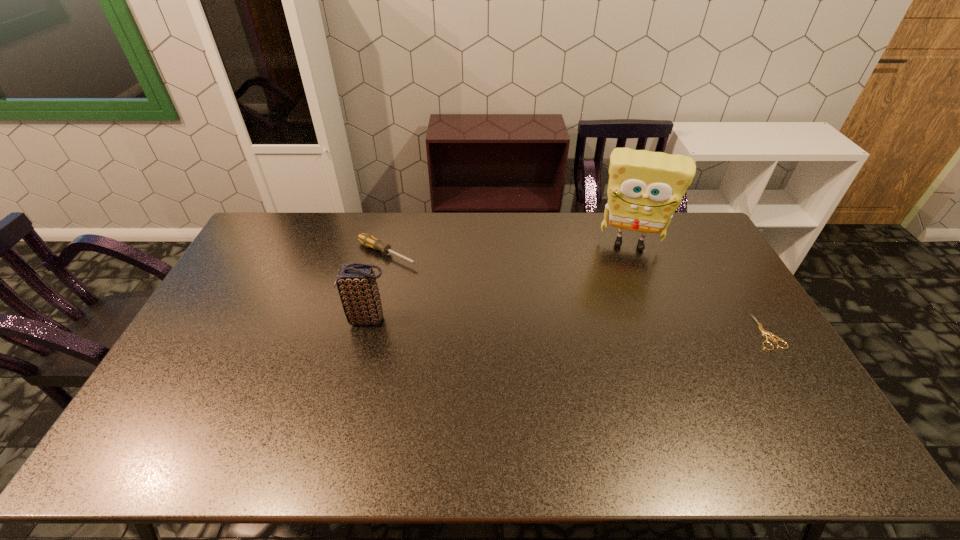
The width and height of the screenshot is (960, 540). In order to click on vacant area between the shortest object and the third shortest object in this screenshot , I will do point(567,326).

I want to click on vacant area that lies between the rightmost object and the screwdriver, so click(x=577, y=293).

This screenshot has height=540, width=960. I want to click on blank region between the second shortest object and the second object from right to left, so click(508, 248).

At what (x,y) coordinates should I click in order to perform the action: click on free point between the second shortest object and the second tallest object. Please return your answer as a coordinate pair (x, y). The width and height of the screenshot is (960, 540). Looking at the image, I should click on (378, 287).

Where is `object identified as the third closest to the clutch bag`? This screenshot has height=540, width=960. object identified as the third closest to the clutch bag is located at coordinates (764, 332).

Choose which object is the third nearest neighbor to the screwdriver. Please provide its 2D coordinates. Your answer should be formatted as a tuple, i.e. [(x, y)], where the tuple contains the x and y coordinates of a point satisfying the conditions above.

[(764, 332)]

Identify the location of vacant position in the image that satisfies the following two spatial constraints: 1. on the front side of the shortest object; 2. on the left side of the third tallest object. (369, 332).

This screenshot has width=960, height=540. Identify the location of blank area in the image that satisfies the following two spatial constraints: 1. on the front side of the screwdriver; 2. on the left side of the rightmost object. (369, 332).

I want to click on free point that satisfies the following two spatial constraints: 1. on the front side of the third object from left to right; 2. on the right side of the shears, so click(664, 332).

At what (x,y) coordinates should I click in order to perform the action: click on free space that satisfies the following two spatial constraints: 1. on the front side of the sponge; 2. on the right side of the rightmost object. Please return your answer as a coordinate pair (x, y). Image resolution: width=960 pixels, height=540 pixels. Looking at the image, I should click on (664, 332).